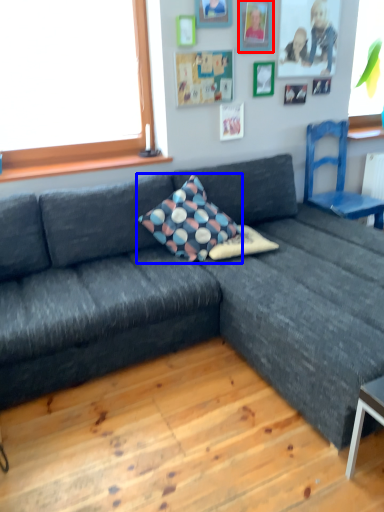
Question: Which of the following is the closest to the observer, picture frame (highlighted by a red box) or pillow (highlighted by a blue box)?

Choices:
 (A) picture frame
 (B) pillow

Answer: (B)